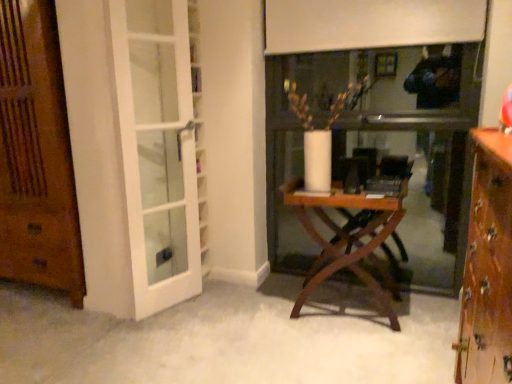
Describe the element at coordinates (487, 266) in the screenshot. This screenshot has height=384, width=512. I see `wooden cabinet at right` at that location.

The height and width of the screenshot is (384, 512). What do you see at coordinates (36, 154) in the screenshot?
I see `wooden door at left` at bounding box center [36, 154].

Locate an element on the screen. This screenshot has width=512, height=384. wooden cabinet at right is located at coordinates (487, 266).

Is wooden folding table at center facing away from white glass door at left?

No, white glass door at left is not at the back of wooden folding table at center.

Does wooden folding table at center have a lesser height compared to white glass door at left?

Correct, wooden folding table at center is not as tall as white glass door at left.

From the image's perspective, is wooden folding table at center positioned above or below white glass door at left?

From the image's perspective, wooden folding table at center appears below white glass door at left.

Is white glass door at left closer to camera compared to wooden door at left?

Yes, white glass door at left is in front of wooden door at left.

From a real-world perspective, is white glass door at left located higher than wooden door at left?

Incorrect, from a real-world perspective, white glass door at left is lower than wooden door at left.

From the image's perspective, which one is positioned higher, white glass door at left or wooden door at left?

wooden door at left, from the image's perspective.

How distant is white glass door at left from wooden door at left?

The distance of white glass door at left from wooden door at left is 21.98 inches.

Is wooden folding table at center to the left of wooden cabinet at right from the viewer's perspective?

Correct, you'll find wooden folding table at center to the left of wooden cabinet at right.

Is wooden folding table at center not within wooden cabinet at right?

Indeed, wooden folding table at center is completely outside wooden cabinet at right.

Between wooden folding table at center and wooden cabinet at right, which one has more height?

wooden cabinet at right is taller.

Is the surface of wooden folding table at center in direct contact with wooden door at left?

No, wooden folding table at center is not making contact with wooden door at left.

In terms of width, does wooden folding table at center look wider or thinner when compared to wooden door at left?

Considering their sizes, wooden folding table at center looks slimmer than wooden door at left.

Which is in front, wooden folding table at center or wooden door at left?

wooden door at left is closer to the camera.

From a real-world perspective, is wooden folding table at center above or below wooden door at left?

wooden folding table at center is below wooden door at left.

Measure the distance between white glass door at left and wooden folding table at center.

white glass door at left and wooden folding table at center are 34.70 inches apart from each other.

Where is `table located below the white glass door at left (from the image's perspective)`? table located below the white glass door at left (from the image's perspective) is located at coordinates (349, 239).

Is white glass door at left bigger than wooden folding table at center?

Incorrect, white glass door at left is not larger than wooden folding table at center.

From a real-world perspective, is white glass door at left positioned over wooden folding table at center based on gravity?

Correct, in the physical world, white glass door at left is higher than wooden folding table at center.

Considering the sizes of objects white glass door at left and wooden cabinet at right in the image provided, who is smaller, white glass door at left or wooden cabinet at right?

white glass door at left.

Is wooden cabinet at right a part of white glass door at left?

No, wooden cabinet at right is located outside of white glass door at left.

From a real-world perspective, who is located higher, white glass door at left or wooden cabinet at right?

In real-world perspective, white glass door at left is above.

From the image's perspective, which is above, white glass door at left or wooden cabinet at right?

white glass door at left.

Consider the image. From a real-world perspective, is wooden cabinet at right physically located above or below white glass door at left?

wooden cabinet at right is situated lower than white glass door at left in the real world.

Consider the image. Considering the positions of objects wooden cabinet at right and white glass door at left in the image provided, who is behind, wooden cabinet at right or white glass door at left?

Positioned behind is white glass door at left.

Is wooden cabinet at right surrounding white glass door at left?

No, wooden cabinet at right does not contain white glass door at left.

The height and width of the screenshot is (384, 512). I want to click on screen door located on the left of wooden folding table at center, so click(x=157, y=149).

I want to click on screen door in front of the wooden door at left, so click(157, 149).

When comparing their distances from wooden cabinet at right, does wooden folding table at center or white glass door at left seem further?

white glass door at left is positioned further to the anchor wooden cabinet at right.

From the image, which object appears to be farther from wooden door at left, white glass door at left or wooden cabinet at right?

Among the two, wooden cabinet at right is located further to wooden door at left.

Looking at the image, which one is located closer to white glass door at left, wooden cabinet at right or wooden folding table at center?

wooden folding table at center.

Based on their spatial positions, is wooden folding table at center or wooden cabinet at right further from white glass door at left?

Based on the image, wooden cabinet at right appears to be further to white glass door at left.

Looking at the image, which one is located closer to wooden folding table at center, wooden cabinet at right or wooden door at left?

wooden cabinet at right.

From the image, which object appears to be nearer to white glass door at left, wooden cabinet at right or wooden door at left?

wooden door at left is positioned closer to the anchor white glass door at left.

Estimate the real-world distances between objects in this image. Which object is closer to white glass door at left, wooden door at left or wooden cabinet at right?

Among the two, wooden door at left is located nearer to white glass door at left.

Estimate the real-world distances between objects in this image. Which object is further from wooden door at left, white glass door at left or wooden folding table at center?

wooden folding table at center is positioned further to the anchor wooden door at left.

Where is `screen door situated between wooden door at left and wooden folding table at center from left to right`? screen door situated between wooden door at left and wooden folding table at center from left to right is located at coordinates (157, 149).

At what (x,y) coordinates should I click in order to perform the action: click on screen door between wooden door at left and wooden cabinet at right in the horizontal direction. Please return your answer as a coordinate pair (x, y). The image size is (512, 384). Looking at the image, I should click on (157, 149).

At what (x,y) coordinates should I click in order to perform the action: click on table between wooden door at left and wooden cabinet at right. Please return your answer as a coordinate pair (x, y). This screenshot has height=384, width=512. Looking at the image, I should click on (349, 239).

The height and width of the screenshot is (384, 512). Find the location of `screen door between wooden cabinet at right and wooden folding table at center along the z-axis`. screen door between wooden cabinet at right and wooden folding table at center along the z-axis is located at coordinates (157, 149).